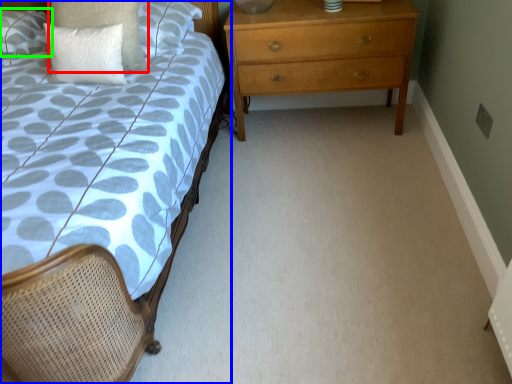
Question: Which is farther away from pillow (highlighted by a red box)? bed (highlighted by a blue box) or pillow (highlighted by a green box)?

Choices:
 (A) bed
 (B) pillow

Answer: (A)